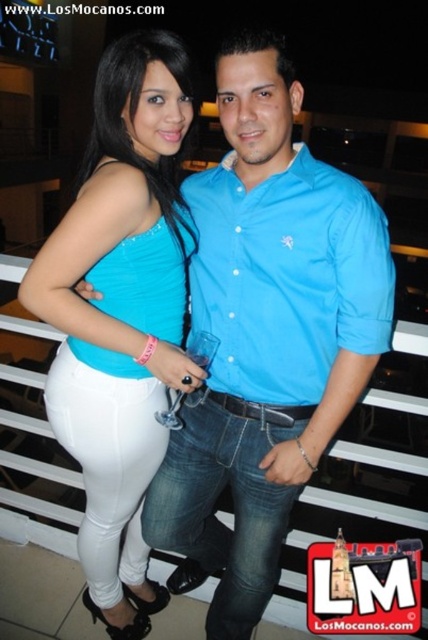
You are a photographer trying to capture the matte blue shirt at center and the matte blue tank top at center in the same frame. Since both are at the center, how can you ensure both are visible in your photo?

The matte blue shirt at center is located above the matte blue tank top at center, so you can adjust your camera angle to include both by focusing slightly upwards to capture the shirt and downwards to include the tank top in the frame.

You are a photographer trying to capture a closeup shot of the two people in the image. You notice that the matte blue shirt at center and the matte blue tank top at center are overlapping slightly. Based on their sizes, which clothing item is wider and might be causing the overlap?

The matte blue shirt at center is wider than the matte blue tank top at center, so it is likely causing the overlap.